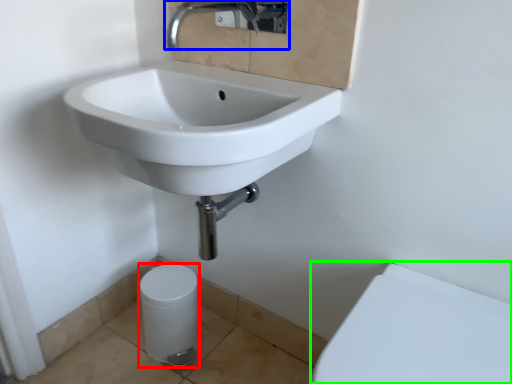
Question: Considering the real-world distances, which object is closest to porcelain (highlighted by a red box)? tap (highlighted by a blue box) or porcelain (highlighted by a green box).

Choices:
 (A) tap
 (B) porcelain

Answer: (B)